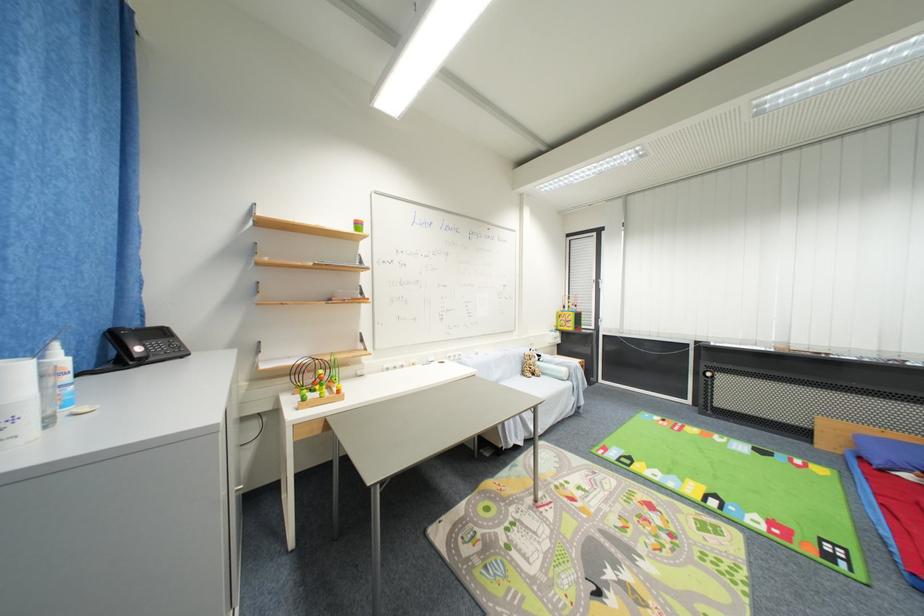
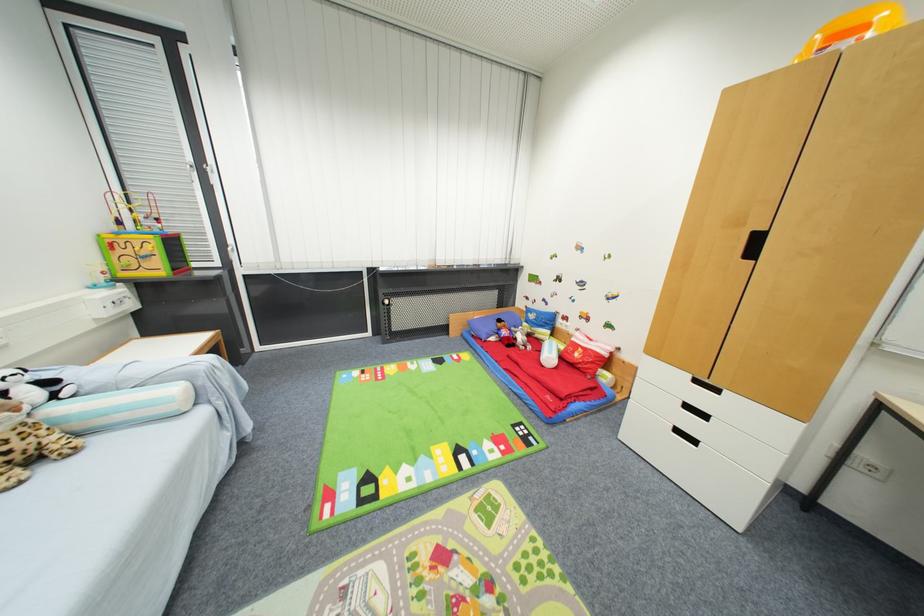
Locate, in the second image, the point that corresponds to [533,371] in the first image.

(7, 456)